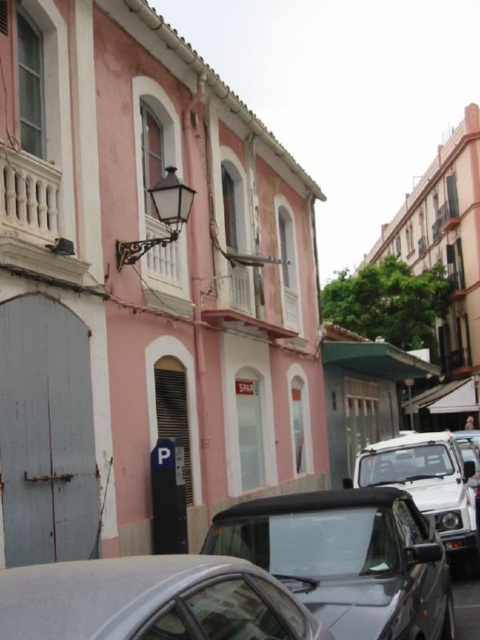
Question: Which of the following is the farthest from the observer?

Choices:
 (A) (359, 538)
 (B) (179, 618)

Answer: (A)

Question: Does black matte car at lower center come in front of satin silver car at lower center?

Choices:
 (A) no
 (B) yes

Answer: (A)

Question: Is black matte car at lower center closer to the viewer compared to metallic silver car at center?

Choices:
 (A) no
 (B) yes

Answer: (B)

Question: Estimate the real-world distances between objects in this image. Which object is farther from the satin silver car at lower center?

Choices:
 (A) metallic silver car at center
 (B) black matte car at lower center

Answer: (A)

Question: Is satin silver car at lower center bigger than metallic silver car at center?

Choices:
 (A) yes
 (B) no

Answer: (B)

Question: Which of these objects is positioned closest to the black matte car at lower center?

Choices:
 (A) metallic silver car at center
 (B) satin silver car at lower center

Answer: (B)